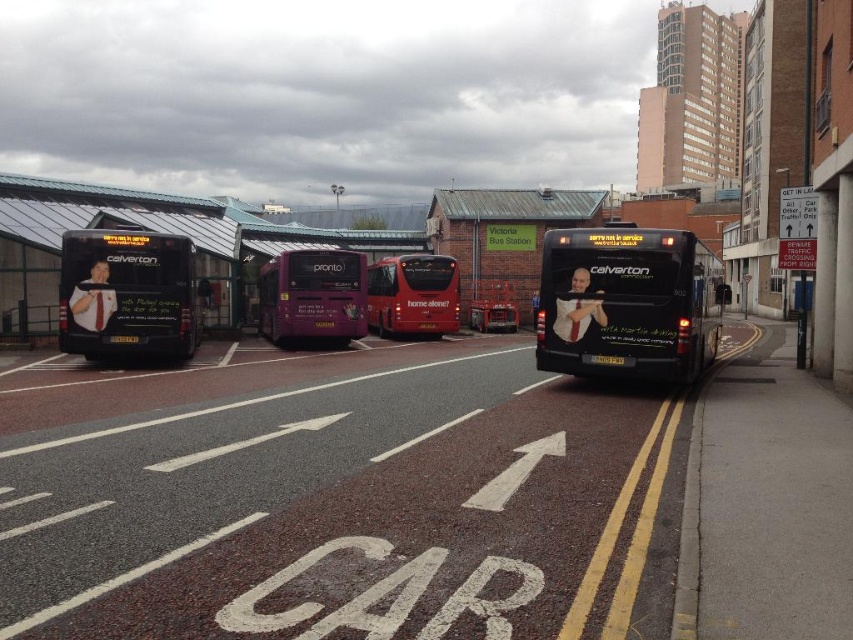
Question: Is matte black bus at left to the left of black plastic license plate at center from the viewer's perspective?

Choices:
 (A) yes
 (B) no

Answer: (B)

Question: Considering the real-world distances, which object is farthest from the black plastic license plate at center?

Choices:
 (A) purple glossy bus at center
 (B) red matte bus at center
 (C) black plastic license plate at rear
 (D) matte black bus at left

Answer: (B)

Question: Among these objects, which one is nearest to the camera?

Choices:
 (A) red matte bus at center
 (B) black plastic license plate at rear

Answer: (B)

Question: Is black matte bus at right wider than black plastic license plate at center?

Choices:
 (A) yes
 (B) no

Answer: (A)

Question: Can you confirm if purple glossy bus at center is positioned above black plastic license plate at center?

Choices:
 (A) no
 (B) yes

Answer: (B)

Question: Which of these objects is positioned closest to the matte black bus at left?

Choices:
 (A) black plastic license plate at rear
 (B) purple glossy bus at center

Answer: (B)